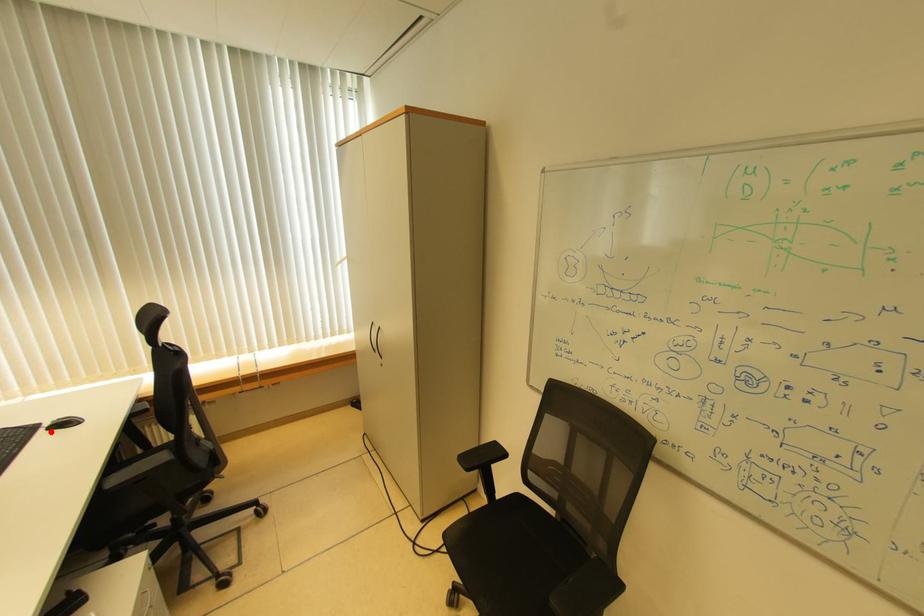
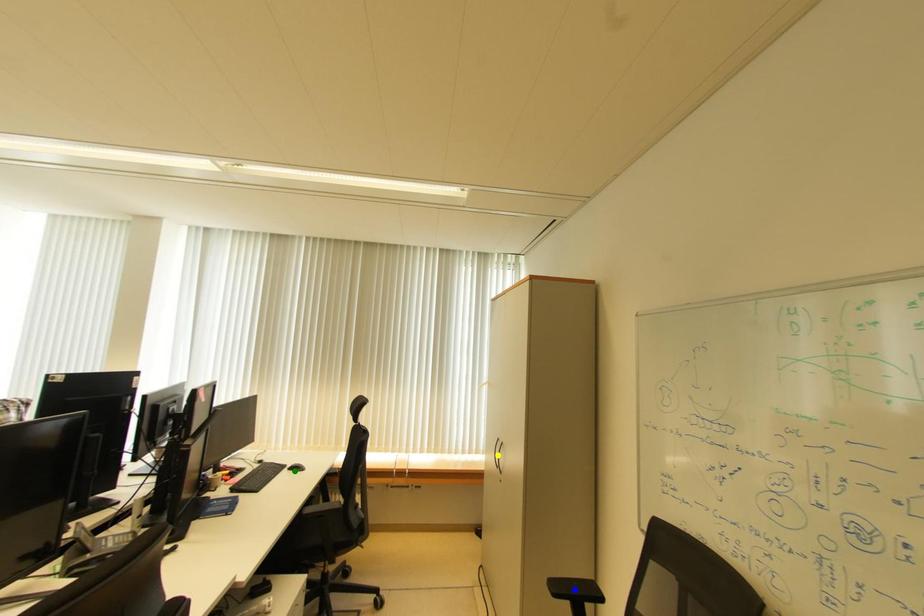
Question: I am providing you with two images of the same scene from different viewpoints. A red point is marked on the first image. You are given multiple points on the second image. Which mark in image 2 goes with the point in image 1?

Choices:
 (A) yellow point
 (B) green point
 (C) blue point

Answer: (B)